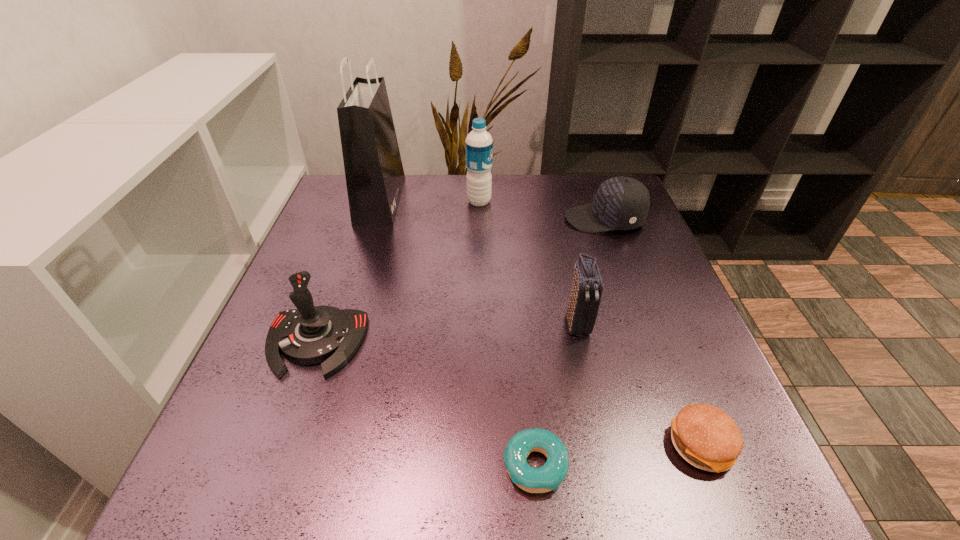
The height and width of the screenshot is (540, 960). In order to click on vacant area between the shortest object and the joystick in this screenshot , I will do `click(425, 404)`.

You are a GUI agent. You are given a task and a screenshot of the screen. Output one action in this format:
    pyautogui.click(x=<x>, y=<y>)
    Task: Click on the free spot between the clutch bag and the second shortest object
    
    Given the screenshot: What is the action you would take?
    pyautogui.click(x=639, y=384)

Locate an element on the screen. The width and height of the screenshot is (960, 540). the fifth closest object to the hamburger is located at coordinates pyautogui.click(x=479, y=145).

This screenshot has height=540, width=960. I want to click on the second closest object relative to the shopping bag, so click(308, 335).

The height and width of the screenshot is (540, 960). In order to click on free spot that satisfies the following two spatial constraints: 1. at the front of the third shortest object where the brim is located; 2. on the right side of the sixth tallest object in this screenshot , I will do `click(686, 446)`.

Where is `free space that satisfies the following two spatial constraints: 1. at the front of the baseball cap where the brim is located; 2. on the handle side of the joystick`? This screenshot has height=540, width=960. free space that satisfies the following two spatial constraints: 1. at the front of the baseball cap where the brim is located; 2. on the handle side of the joystick is located at coordinates (649, 343).

Locate an element on the screen. vacant region that satisfies the following two spatial constraints: 1. on the label of the doughnut; 2. on the right side of the second tallest object is located at coordinates coord(478,465).

Find the location of `vacant region that satisfies the following two spatial constraints: 1. with the zip open on the clutch bag; 2. on the left side of the second shortest object`. vacant region that satisfies the following two spatial constraints: 1. with the zip open on the clutch bag; 2. on the left side of the second shortest object is located at coordinates (604, 446).

The width and height of the screenshot is (960, 540). What are the coordinates of `vacant space that satisfies the following two spatial constraints: 1. on the label of the shortest object; 2. on the left side of the fifth object from right to left` in the screenshot? It's located at (478, 465).

You are a GUI agent. You are given a task and a screenshot of the screen. Output one action in this format:
    pyautogui.click(x=<x>, y=<y>)
    Task: Click on the vacant space that satisfies the following two spatial constraints: 1. on the label of the third object from left to right; 2. on the handle side of the joystick
    This screenshot has height=540, width=960.
    Given the screenshot: What is the action you would take?
    pyautogui.click(x=479, y=343)